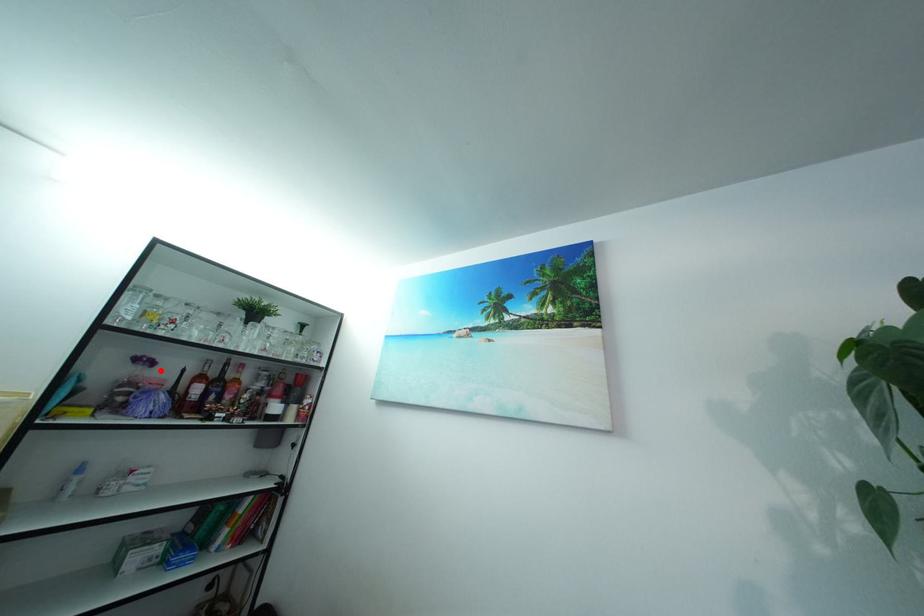
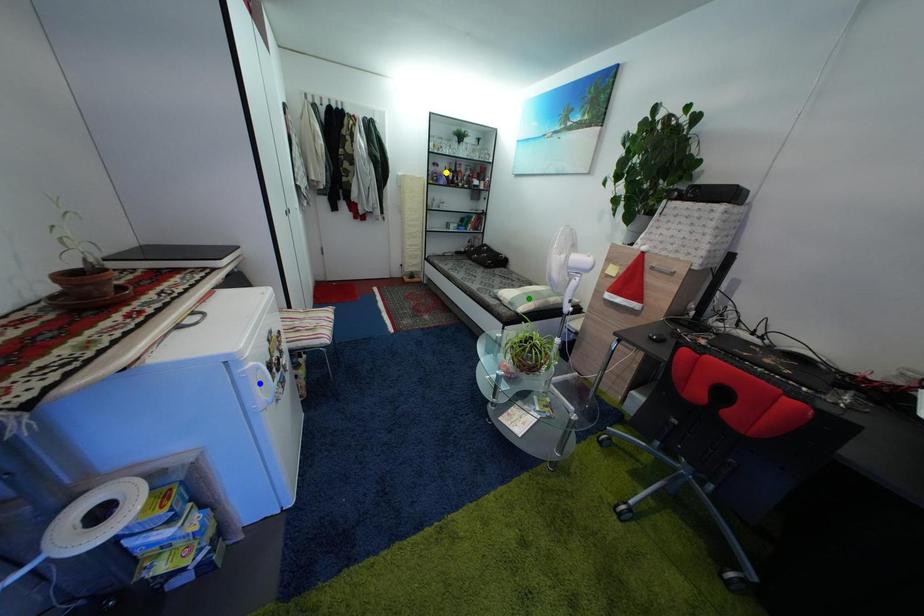
Question: I am providing you with two images of the same scene from different viewpoints. A red point is marked on the first image. You are given multiple points on the second image. Which point in image 2 represents the same 3d spot as the red point in image 1?

Choices:
 (A) green point
 (B) yellow point
 (C) blue point

Answer: (B)